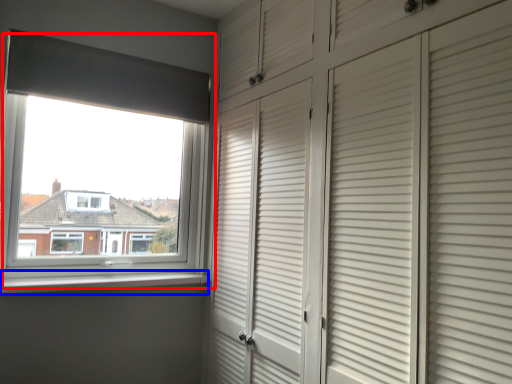
Question: Which object appears closest to the camera in this image, window (highlighted by a red box) or window sill (highlighted by a blue box)?

Choices:
 (A) window
 (B) window sill

Answer: (B)